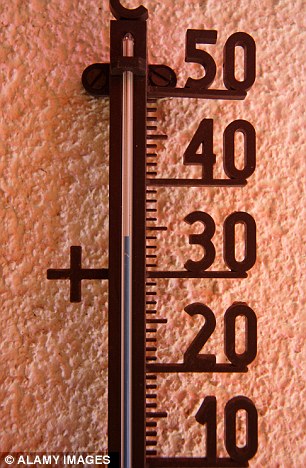
I want to click on glass, so click(129, 97).